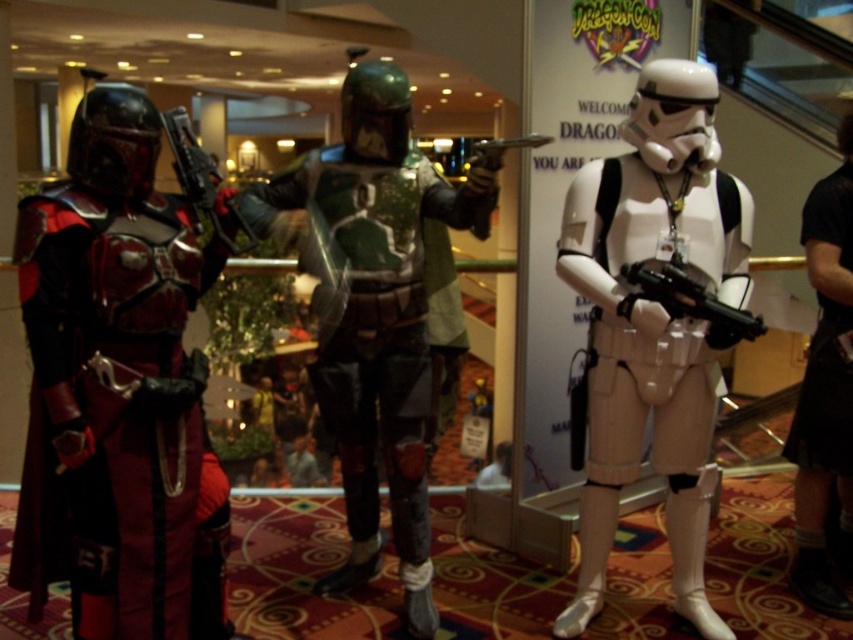
Is point (184, 540) positioned behind point (599, 410)?

No, it is not.

Which of these two, shiny red armor at left or white matte stormtrooper at center, stands taller?

white matte stormtrooper at center

Does point (103, 234) come closer to viewer compared to point (654, 344)?

Yes, it is in front of point (654, 344).

In order to click on shiny red armor at left in this screenshot , I will do `click(119, 419)`.

Can you confirm if green camouflage armor at center is thinner than metallic silver gun at center?

In fact, green camouflage armor at center might be wider than metallic silver gun at center.

Is green camouflage armor at center further to camera compared to metallic silver gun at center?

No, green camouflage armor at center is closer to the viewer.

Is point (384, 204) positioned after point (480, 157)?

Yes.

Find the location of `green camouflage armor at center`. green camouflage armor at center is located at coordinates [x=376, y=312].

Is black leather pants at lower right below matte black gun at left?

Indeed, black leather pants at lower right is positioned under matte black gun at left.

Is point (822, 236) positioned after point (200, 166)?

Yes, point (822, 236) is farther from viewer.

Identify the location of black leather pants at lower right. (825, 390).

In order to click on black leather pants at lower right in this screenshot , I will do `click(825, 390)`.